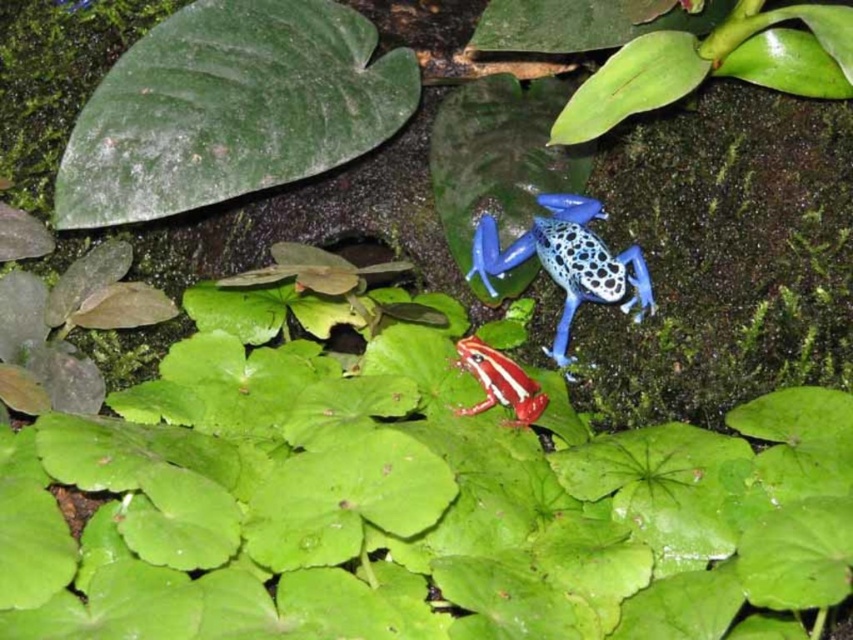
Question: Can you confirm if blue glossy spotted frog at center is thinner than smooth red and white frog at center?

Choices:
 (A) no
 (B) yes

Answer: (A)

Question: Which point is closer to the camera taking this photo?

Choices:
 (A) (616, 269)
 (B) (488, 368)

Answer: (B)

Question: Does blue glossy spotted frog at center lie in front of smooth red and white frog at center?

Choices:
 (A) yes
 (B) no

Answer: (B)

Question: Can you confirm if blue glossy spotted frog at center is positioned below smooth red and white frog at center?

Choices:
 (A) yes
 (B) no

Answer: (B)